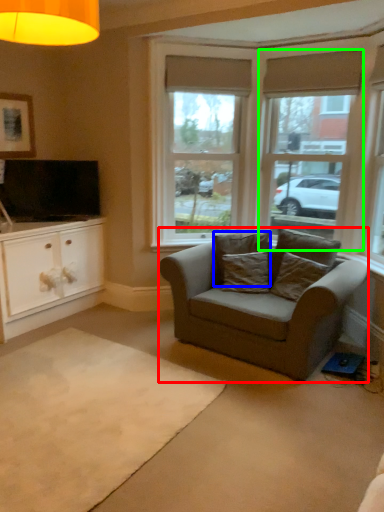
Question: Estimate the real-world distances between objects in this image. Which object is closer to studio couch (highlighted by a red box), pillow (highlighted by a blue box) or window (highlighted by a green box)?

Choices:
 (A) pillow
 (B) window

Answer: (A)